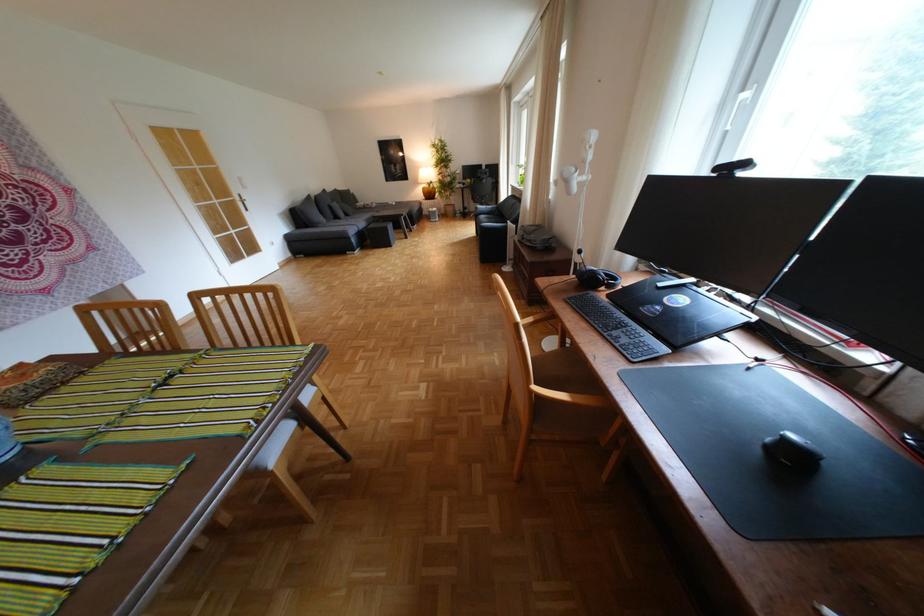
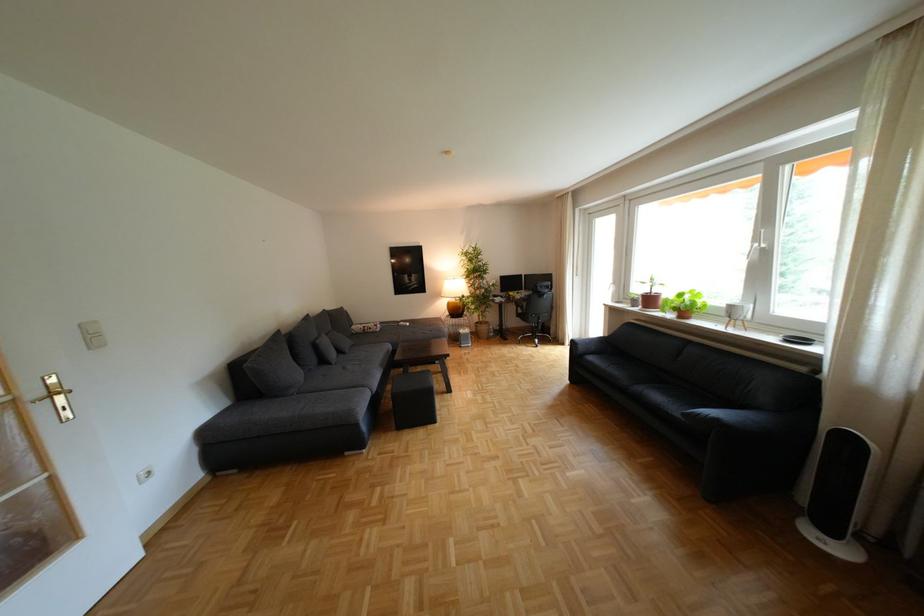
What movement of the cameraman would produce the second image?

The movement direction of the cameraman is left, forward.